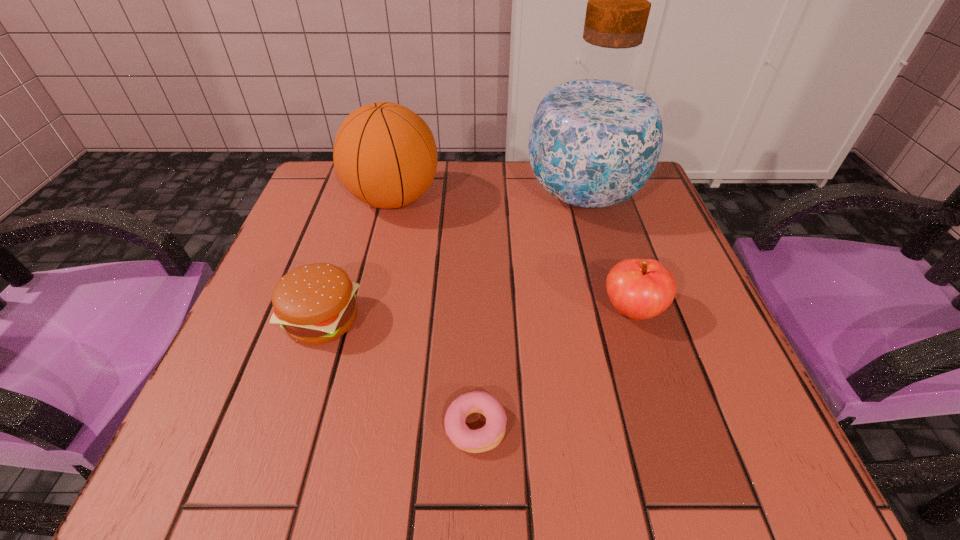
The image size is (960, 540). Identify the location of free region that satisfies the following two spatial constraints: 1. on the back side of the shortest object; 2. on the left side of the water jug. click(x=477, y=195).